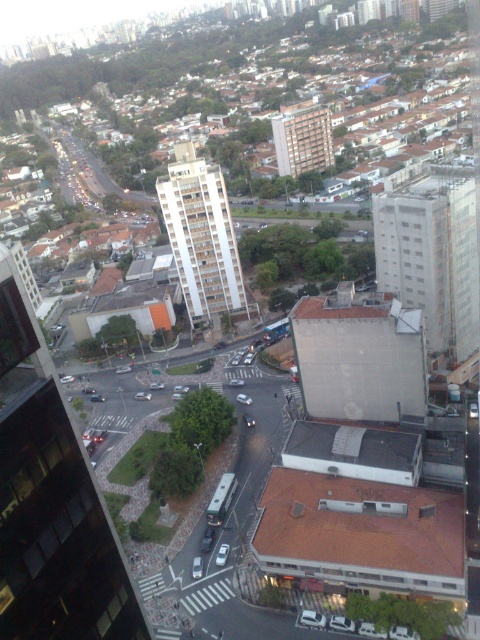
You are a drone operator planning to fly a drone between the white smooth building at center and the brown brick building at center. The drone has a maximum flight height of 10 meters. Can the drone safely navigate between these two buildings without hitting either?

The white smooth building at center has a greater height compared to the brown brick building at center. Since the drone has a maximum flight height of 10 meters, it depends on the actual height of the shorter building. If the brown brick building at center is under 10 meters, the drone can fly above it but might collide with the taller white smooth building at center. Without specific height measurements, we cannot confirm safety.

In the scene shown: You are a city planner analyzing the urban layout. You notice two buildings in the center of the image. The first is labeled as the white concrete building at center, and the second is the white smooth building at center. Based on their sizes, which one would require more space for construction? Please explain your reasoning.

The white concrete building at center has a larger size compared to the white smooth building at center, so it would require more space for construction due to its greater dimensions.